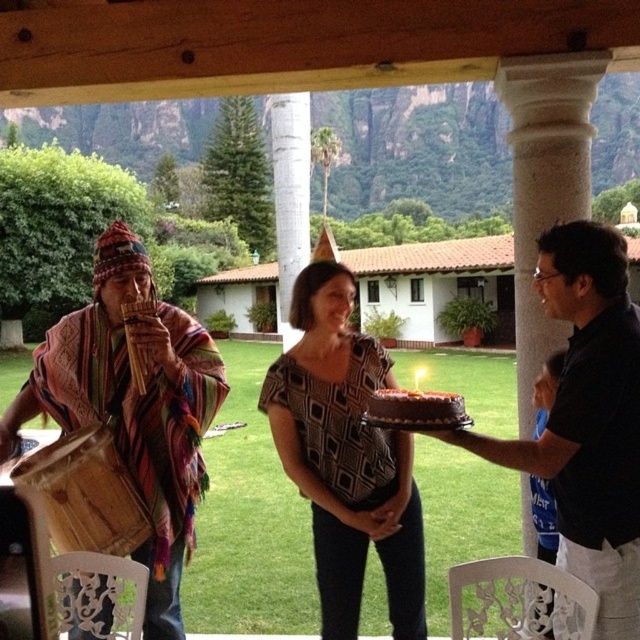
You are a photographer at the celebration and want to take a photo of the patterned fabric dress at center and the chocolate frosted cake at center. Which object is closer to you?

The patterned fabric dress at center is closer to you than the chocolate frosted cake at center.

You are a photographer at the event and want to capture both the wooden flute at left and the chocolate frosted cake at center in a single frame. Which object should you focus on first to ensure both are in the frame?

You should focus on the wooden flute at left first since it is wider than the chocolate frosted cake at center, ensuring it fits within the frame.

You are a photographer at the celebration and need to capture a closeup of both the black matte shirt at center and the chocolate frosted cake at center. Which object should you zoom in on first to ensure it fills the frame without moving the camera?

The black matte shirt at center is bigger than the chocolate frosted cake at center, so you should zoom in on the black matte shirt at center first to ensure it fills the frame without moving the camera.